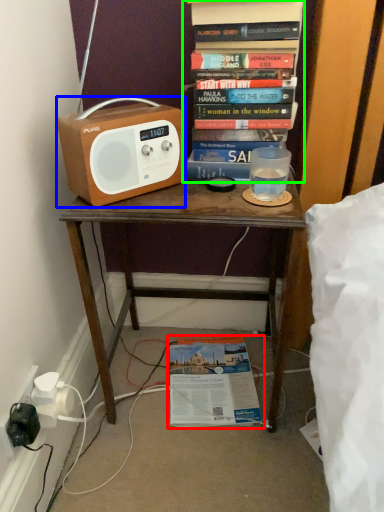
Question: Which object is the farthest from book (highlighted by a red box)? Choose among these: cassette (highlighted by a blue box) or book (highlighted by a green box).

Choices:
 (A) cassette
 (B) book

Answer: (B)